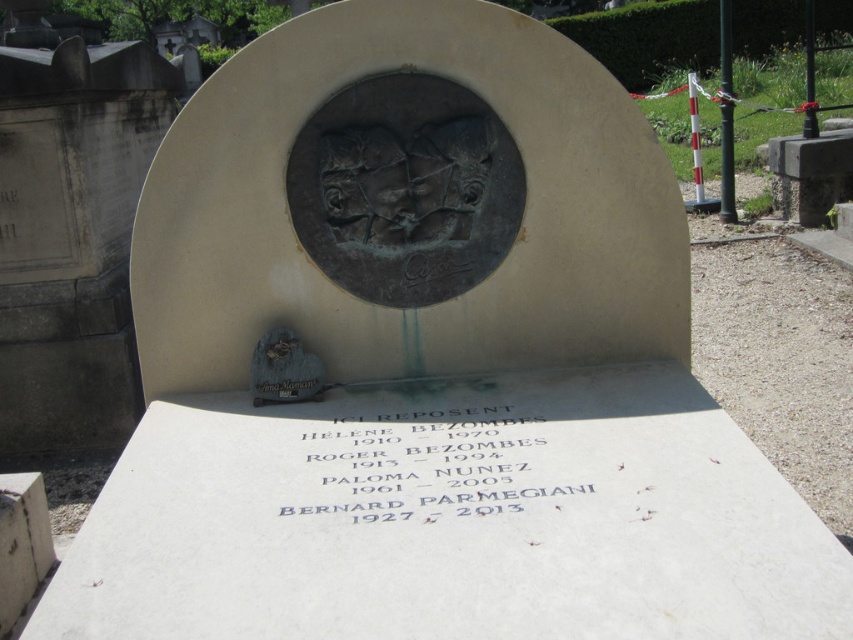
Question: Which of these objects is positioned closest to the bronze plaque at center?

Choices:
 (A) shiny bronze heart at center
 (B) black stone inscription at center

Answer: (A)

Question: Can you confirm if bronze plaque at center is bigger than shiny bronze heart at center?

Choices:
 (A) no
 (B) yes

Answer: (B)

Question: Considering the real-world distances, which object is farthest from the bronze plaque at center?

Choices:
 (A) black stone inscription at center
 (B) shiny bronze heart at center

Answer: (A)

Question: Can you confirm if bronze plaque at center is thinner than shiny bronze heart at center?

Choices:
 (A) yes
 (B) no

Answer: (B)

Question: Among these points, which one is farthest from the camera?

Choices:
 (A) (537, 442)
 (B) (283, 332)

Answer: (B)

Question: Can you confirm if black stone inscription at center is positioned above shiny bronze heart at center?

Choices:
 (A) no
 (B) yes

Answer: (A)